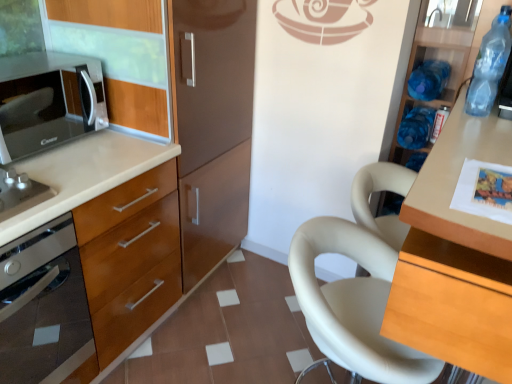
I want to click on empty space that is ontop of blue plastic bottle at upper right, the 2th bottle from the front (from a real-world perspective), so click(x=426, y=69).